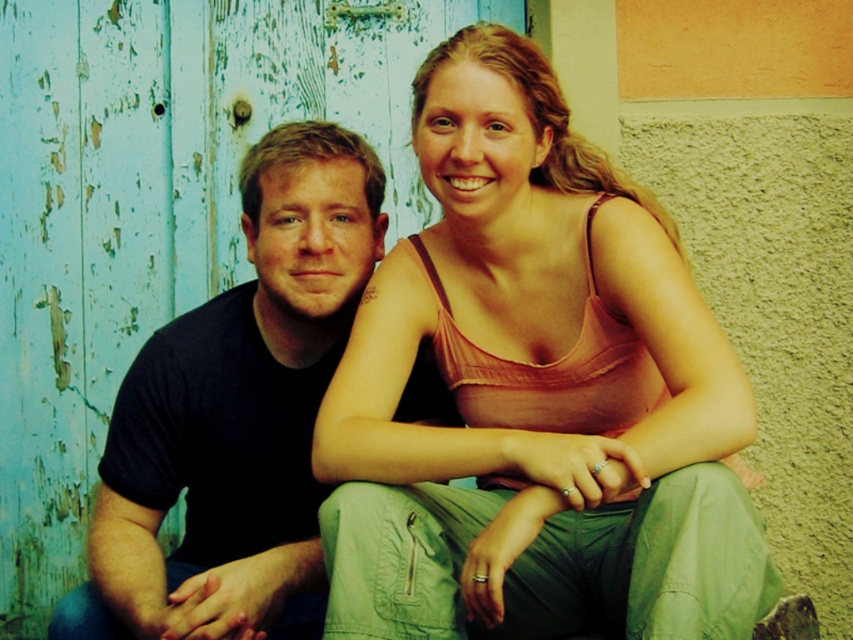
Looking at this image, you are trying to decide which clothing item to take for a quick trip. The matte orange tank top at center and the black cotton shirt at left are both options. Based on their sizes, which one might be more suitable for packing efficiently?

The matte orange tank top at center is wider than the black cotton shirt at left, so it might take up more space when packing. The black cotton shirt at left could be more suitable for efficient packing due to its narrower width.

In the scene shown: You are a photographer setting up a shoot in front of a rustic blue wooden door. You notice two people wearing the matte orange tank top at center and the black cotton shirt at left. Which clothing item is closer to the camera?

The matte orange tank top at center is closer to the camera since it is in front of the black cotton shirt at left.